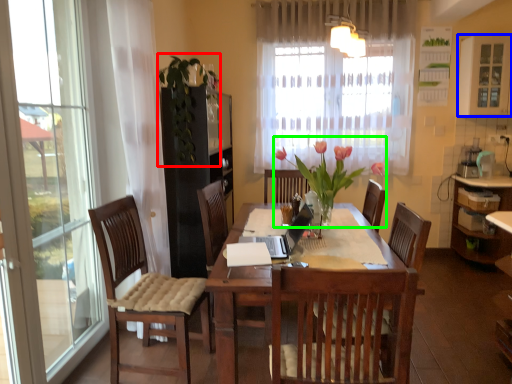
Question: Based on their relative distances, which object is nearer to floral arrangement (highlighted by a red box)? Choose from window (highlighted by a blue box) and floral arrangement (highlighted by a green box).

Choices:
 (A) window
 (B) floral arrangement

Answer: (B)